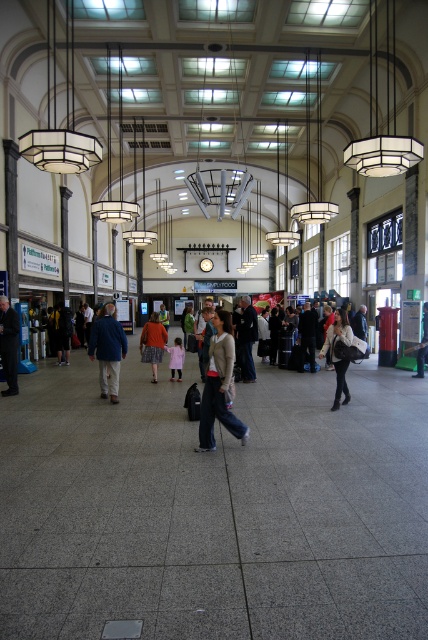
You are standing in the train station and notice a matte beige sweater at center and a camera somewhere in the scene. How far apart are these two items from each other?

The matte beige sweater at center and camera are 19.28 feet apart.

You are a traveler in the train station and you see a matte beige sweater at center and a dark blue suit at left. Which one is positioned to the right of the other?

The matte beige sweater at center is positioned to the right of the dark blue suit at left.

You are a traveler at the train station and you see two coats hanging on a rack in the center of the station. The coats are labeled as the matte red jacket at center and the matte black jacket at center. Which coat is on top of the other?

The matte red jacket at center is positioned over the matte black jacket at center, so the matte red jacket at center is on top of the matte black jacket at center.